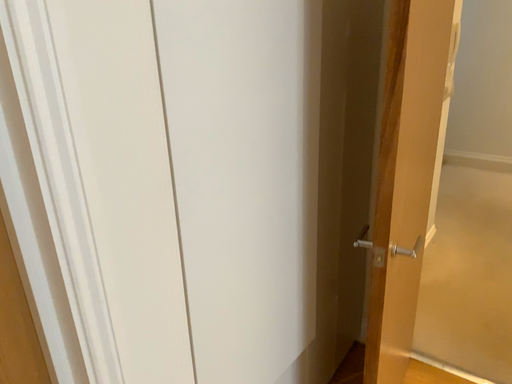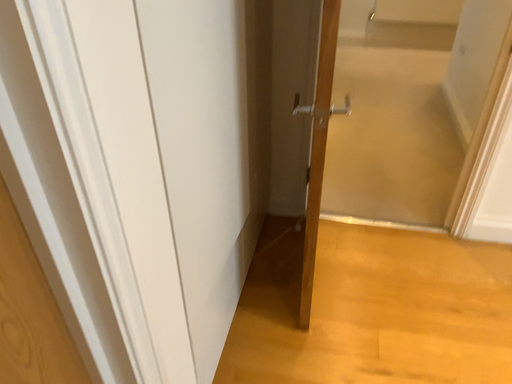
Question: How did the camera likely rotate when shooting the video?

Choices:
 (A) rotated right
 (B) rotated left

Answer: (A)